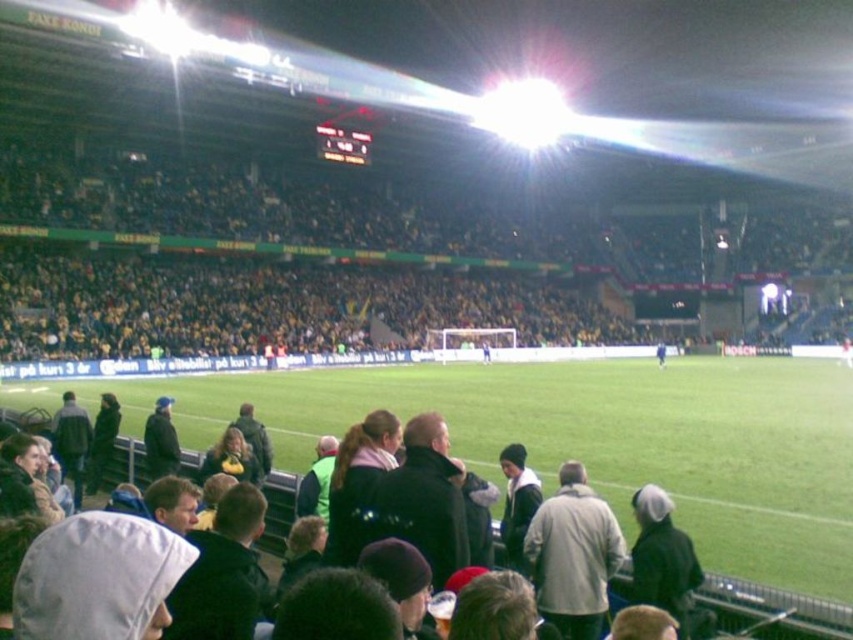
Does point (21, 348) come closer to viewer compared to point (670, 538)?

No.

Is yellow jersey at upper center closer to the viewer compared to dark gray hooded sweatshirt at lower left?

That is False.

You are a GUI agent. You are given a task and a screenshot of the screen. Output one action in this format:
    pyautogui.click(x=<x>, y=<y>)
    Task: Click on the yellow jersey at upper center
    Image resolution: width=853 pixels, height=640 pixels.
    Given the screenshot: What is the action you would take?
    pyautogui.click(x=322, y=214)

At what (x,y) coordinates should I click in order to perform the action: click on yellow jersey at upper center. Please return your answer as a coordinate pair (x, y). Looking at the image, I should click on [322, 214].